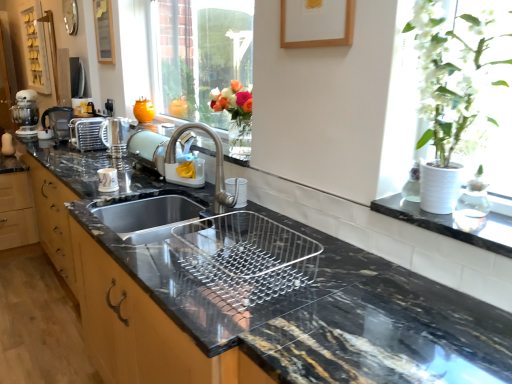
The height and width of the screenshot is (384, 512). I want to click on free space in front of metallic silver coffee machine at left, so click(x=51, y=144).